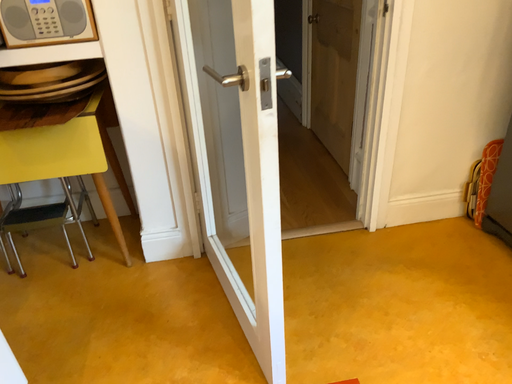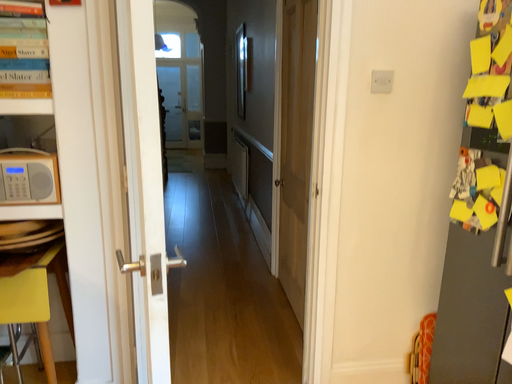
Question: How did the camera likely rotate when shooting the video?

Choices:
 (A) rotated upward
 (B) rotated downward

Answer: (A)